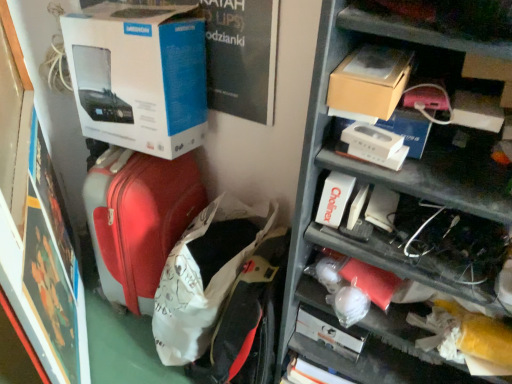
Question: Should I look upward or downward to see matte red suitcase at left?

Choices:
 (A) up
 (B) down

Answer: (B)

Question: Is metallic gray shelves at upper right positioned with its back to matte red suitcase at left?

Choices:
 (A) no
 (B) yes

Answer: (A)

Question: Considering the relative sizes of metallic gray shelves at upper right and matte red suitcase at left in the image provided, is metallic gray shelves at upper right thinner than matte red suitcase at left?

Choices:
 (A) yes
 (B) no

Answer: (B)

Question: Considering the relative sizes of metallic gray shelves at upper right and matte red suitcase at left in the image provided, is metallic gray shelves at upper right shorter than matte red suitcase at left?

Choices:
 (A) yes
 (B) no

Answer: (B)

Question: Is metallic gray shelves at upper right directly adjacent to matte red suitcase at left?

Choices:
 (A) no
 (B) yes

Answer: (A)

Question: Does metallic gray shelves at upper right contain matte red suitcase at left?

Choices:
 (A) yes
 (B) no

Answer: (B)

Question: Does metallic gray shelves at upper right lie behind matte red suitcase at left?

Choices:
 (A) no
 (B) yes

Answer: (A)

Question: Is metallic gray shelves at upper right at the back of brown cardboard box at upper right?

Choices:
 (A) no
 (B) yes

Answer: (B)

Question: Does brown cardboard box at upper right have a lesser width compared to metallic gray shelves at upper right?

Choices:
 (A) no
 (B) yes

Answer: (B)

Question: Is brown cardboard box at upper right to the right of metallic gray shelves at upper right from the viewer's perspective?

Choices:
 (A) yes
 (B) no

Answer: (B)

Question: From the image's perspective, is brown cardboard box at upper right on metallic gray shelves at upper right?

Choices:
 (A) no
 (B) yes

Answer: (B)

Question: Considering the relative sizes of brown cardboard box at upper right and metallic gray shelves at upper right in the image provided, is brown cardboard box at upper right bigger than metallic gray shelves at upper right?

Choices:
 (A) yes
 (B) no

Answer: (B)

Question: Could you tell me if brown cardboard box at upper right is facing metallic gray shelves at upper right?

Choices:
 (A) no
 (B) yes

Answer: (B)

Question: From the image's perspective, is matte red suitcase at center over brown cardboard box at upper right?

Choices:
 (A) yes
 (B) no

Answer: (B)